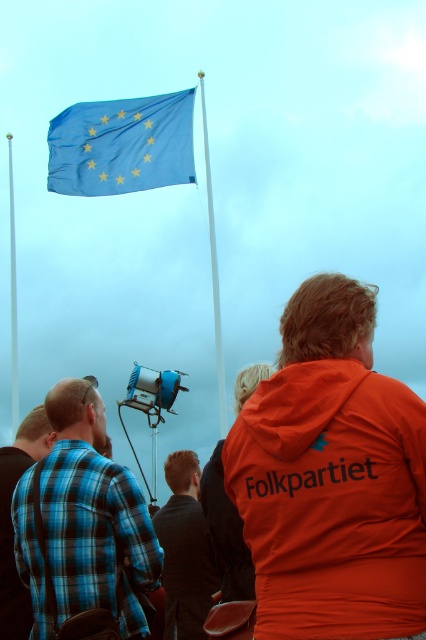
Question: Which object is the closest to the white plastic flag pole at upper center?

Choices:
 (A) blue plaid shirt at left
 (B) white metallic flag pole at upper center

Answer: (B)

Question: Does orange fabric jacket at center have a greater width compared to dark brown leather jacket at center?

Choices:
 (A) no
 (B) yes

Answer: (A)

Question: From the image, what is the correct spatial relationship of blue fabric flag at upper center in relation to white metallic flag pole at upper center?

Choices:
 (A) left
 (B) right

Answer: (A)

Question: Is orange fabric jacket at center below blue plaid shirt at left?

Choices:
 (A) no
 (B) yes

Answer: (A)

Question: Which is farther from the white plastic flag pole at upper center?

Choices:
 (A) blue plaid shirt at left
 (B) white metallic flag pole at upper center
 (C) dark brown leather jacket at center
 (D) blue plaid shirt at lower left

Answer: (D)

Question: Which of the following is the farthest from the observer?

Choices:
 (A) blue fabric flag at upper center
 (B) blue plaid shirt at lower left

Answer: (A)